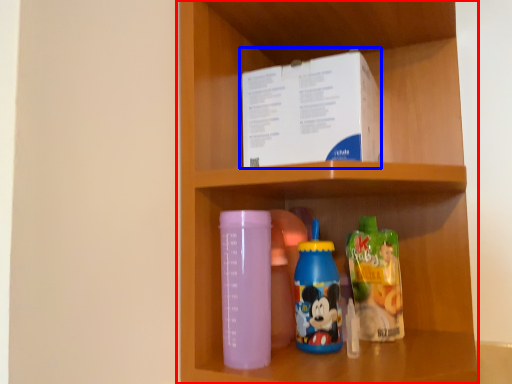
Question: Which point is closer to the camera, shelf (highlighted by a red box) or box (highlighted by a blue box)?

Choices:
 (A) shelf
 (B) box

Answer: (A)